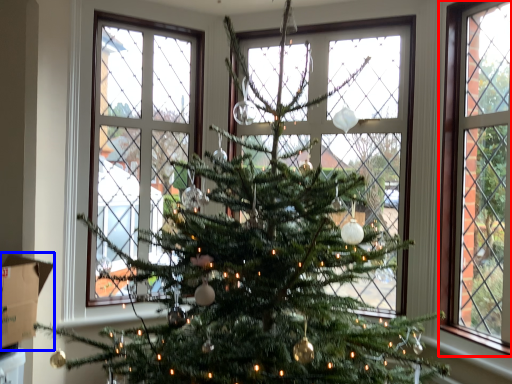
Question: Which of the following is the closest to the observer, window (highlighted by a red box) or cardboard box (highlighted by a blue box)?

Choices:
 (A) window
 (B) cardboard box

Answer: (B)